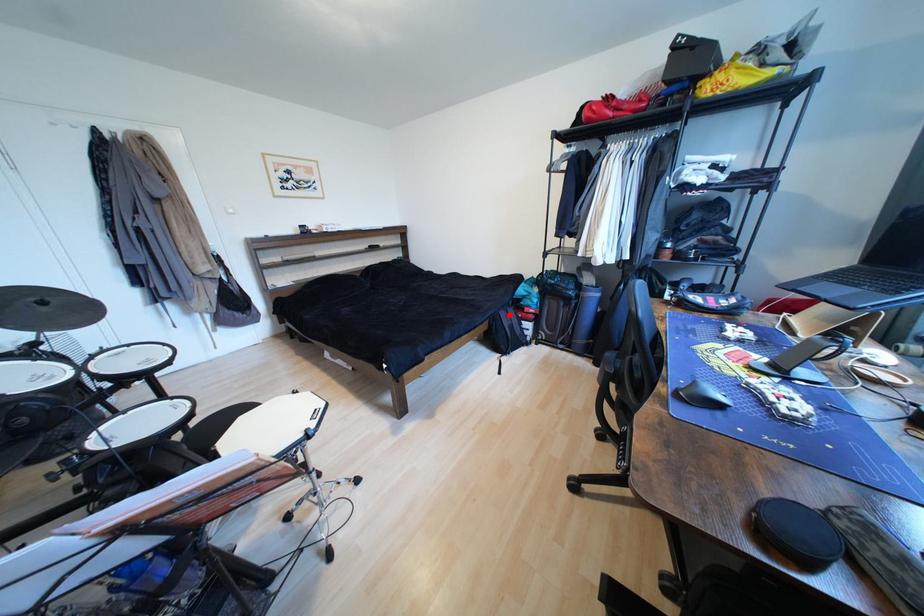
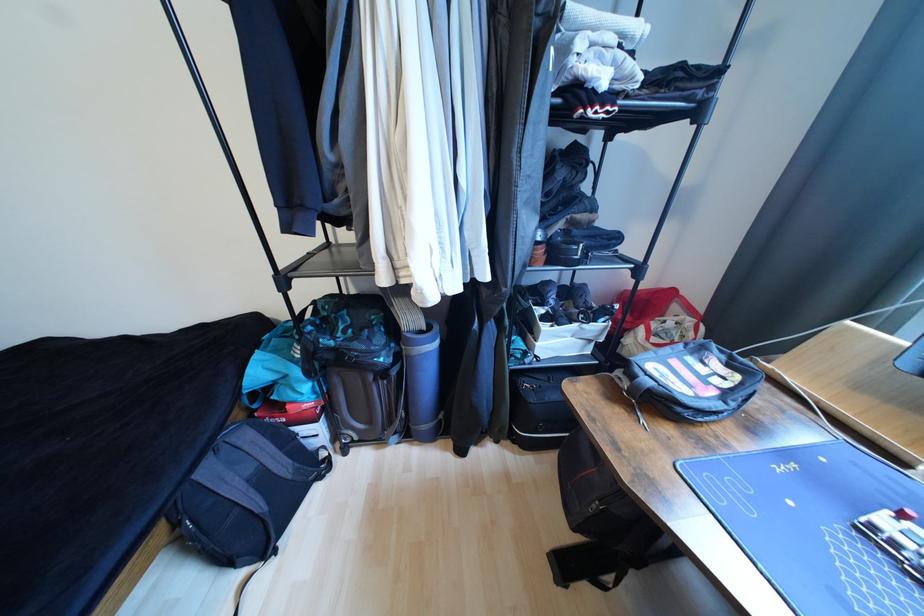
Question: I am providing you with two images of the same scene from different viewpoints. A red point is marked on the first image. At the location where the point appears in image 1, is it still visible in image 2?

Choices:
 (A) Yes
 (B) No

Answer: (A)